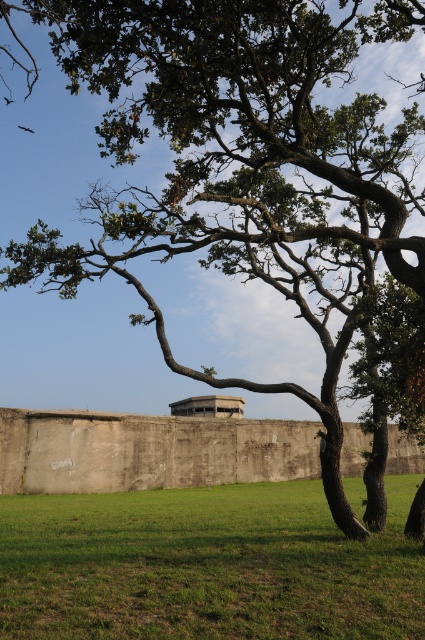
Is point (14, 588) closer to camera compared to point (348, 440)?

Yes, point (14, 588) is in front of point (348, 440).

Can you confirm if green grass at center is taller than concrete wall at center?

No.

What are the coordinates of `green grass at center` in the screenshot? It's located at (206, 566).